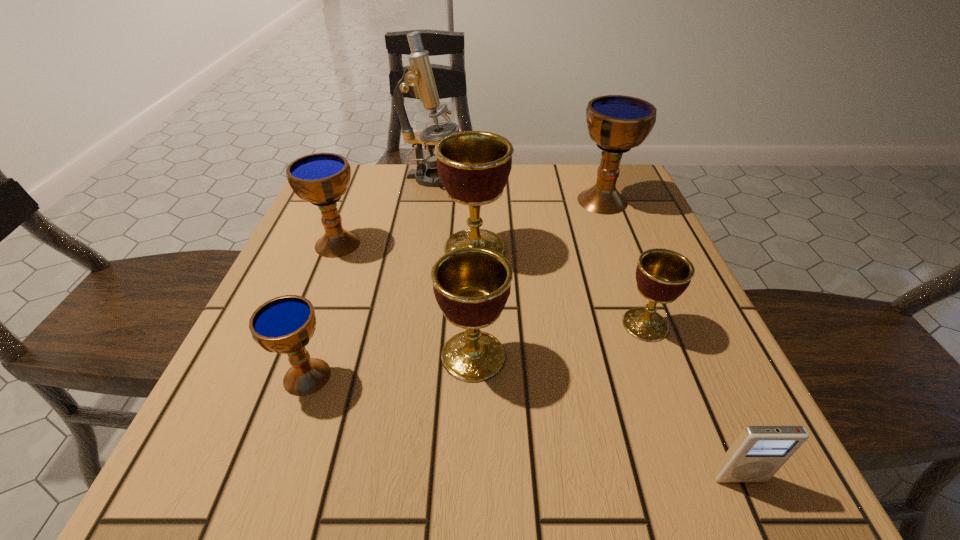
Identify which chalice is located as the nearest to the nearest blue chalice. Please provide its 2D coordinates. Your answer should be formatted as a tuple, i.e. [(x, y)], where the tuple contains the x and y coordinates of a point satisfying the conditions above.

[(471, 285)]

Where is `the closest blue chalice to the second biggest blue chalice`? the closest blue chalice to the second biggest blue chalice is located at coordinates pyautogui.click(x=285, y=324).

Locate which blue chalice ranks second in proximity to the second biggest golden chalice. Please provide its 2D coordinates. Your answer should be formatted as a tuple, i.e. [(x, y)], where the tuple contains the x and y coordinates of a point satisfying the conditions above.

[(321, 178)]

Identify which golden chalice is the third closest to the second biggest blue chalice. Please provide its 2D coordinates. Your answer should be formatted as a tuple, i.e. [(x, y)], where the tuple contains the x and y coordinates of a point satisfying the conditions above.

[(662, 275)]

Find the location of a particular element. Image resolution: width=960 pixels, height=540 pixels. golden chalice identified as the closest to the nearest object is located at coordinates (662, 275).

Identify the location of free location that satisfies the following two spatial constraints: 1. on the front side of the biggest golden chalice; 2. on the right side of the microscope. click(422, 248).

At what (x,y) coordinates should I click in order to perform the action: click on free space that satisfies the following two spatial constraints: 1. on the back side of the biggest golden chalice; 2. on the left side of the second smallest golden chalice. Please return your answer as a coordinate pair (x, y). The width and height of the screenshot is (960, 540). Looking at the image, I should click on (475, 248).

Locate an element on the screen. The height and width of the screenshot is (540, 960). vacant space that satisfies the following two spatial constraints: 1. on the front side of the rightmost golden chalice; 2. on the right side of the microscope is located at coordinates (410, 325).

Locate an element on the screen. free spot that satisfies the following two spatial constraints: 1. on the front side of the biggest golden chalice; 2. on the left side of the second farthest blue chalice is located at coordinates (336, 248).